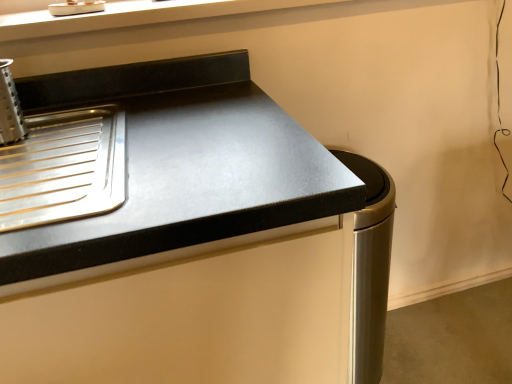
Find the location of a particular element. black matte countertop at upper left is located at coordinates (183, 165).

Image resolution: width=512 pixels, height=384 pixels. What do you see at coordinates (183, 165) in the screenshot?
I see `black matte countertop at upper left` at bounding box center [183, 165].

Where is `satin silver trash can at lower right`? This screenshot has width=512, height=384. satin silver trash can at lower right is located at coordinates (370, 267).

Describe the element at coordinates (370, 267) in the screenshot. The image size is (512, 384). I see `satin silver trash can at lower right` at that location.

The image size is (512, 384). I want to click on black matte countertop at upper left, so click(183, 165).

Between satin silver trash can at lower right and black matte countertop at upper left, which one appears on the right side from the viewer's perspective?

From the viewer's perspective, satin silver trash can at lower right appears more on the right side.

Is satin silver trash can at lower right in front of or behind black matte countertop at upper left in the image?

Clearly, satin silver trash can at lower right is behind black matte countertop at upper left.

Does point (364, 275) come in front of point (95, 240)?

No, (364, 275) is behind (95, 240).

From the image's perspective, is satin silver trash can at lower right above or below black matte countertop at upper left?

satin silver trash can at lower right is situated higher than black matte countertop at upper left in the image.

From a real-world perspective, is satin silver trash can at lower right located higher than black matte countertop at upper left?

No.

Considering the relative sizes of satin silver trash can at lower right and black matte countertop at upper left in the image provided, is satin silver trash can at lower right thinner than black matte countertop at upper left?

Correct, the width of satin silver trash can at lower right is less than that of black matte countertop at upper left.

Is satin silver trash can at lower right taller or shorter than black matte countertop at upper left?

In the image, satin silver trash can at lower right appears to be shorter than black matte countertop at upper left.

Based on their sizes in the image, would you say satin silver trash can at lower right is bigger or smaller than black matte countertop at upper left?

satin silver trash can at lower right is smaller than black matte countertop at upper left.

Is satin silver trash can at lower right not within black matte countertop at upper left?

Yes, satin silver trash can at lower right is outside of black matte countertop at upper left.

Is satin silver trash can at lower right placed right next to black matte countertop at upper left?

No, satin silver trash can at lower right is not beside black matte countertop at upper left.

Is satin silver trash can at lower right positioned with its back to black matte countertop at upper left?

No, satin silver trash can at lower right is not facing the opposite direction of black matte countertop at upper left.

How different are the orientations of satin silver trash can at lower right and black matte countertop at upper left in degrees?

The angle between the facing direction of satin silver trash can at lower right and the facing direction of black matte countertop at upper left is 3.17 degrees.

Measure the distance between satin silver trash can at lower right and black matte countertop at upper left.

satin silver trash can at lower right and black matte countertop at upper left are 17.11 inches apart.

Locate an element on the screen. appliance that appears behind the black matte countertop at upper left is located at coordinates pyautogui.click(x=370, y=267).

Is black matte countertop at upper left at the left side of satin silver trash can at lower right?

Yes, black matte countertop at upper left is to the left of satin silver trash can at lower right.

Which object is closer to the camera, black matte countertop at upper left or satin silver trash can at lower right?

black matte countertop at upper left.

Does point (152, 105) appear closer or farther from the camera than point (367, 200)?

Point (152, 105) appears to be farther away from the viewer than point (367, 200).

From the image's perspective, is black matte countertop at upper left positioned above or below satin silver trash can at lower right?

black matte countertop at upper left is below satin silver trash can at lower right.

Based on the photo, from a real-world perspective, is black matte countertop at upper left on top of satin silver trash can at lower right?

Yes, from a real-world perspective, black matte countertop at upper left is over satin silver trash can at lower right

Which of these two, black matte countertop at upper left or satin silver trash can at lower right, is thinner?

With smaller width is satin silver trash can at lower right.

Considering the sizes of black matte countertop at upper left and satin silver trash can at lower right in the image, is black matte countertop at upper left taller or shorter than satin silver trash can at lower right?

black matte countertop at upper left is taller than satin silver trash can at lower right.

Considering the sizes of objects black matte countertop at upper left and satin silver trash can at lower right in the image provided, who is smaller, black matte countertop at upper left or satin silver trash can at lower right?

satin silver trash can at lower right is smaller.

Can we say black matte countertop at upper left lies outside satin silver trash can at lower right?

Yes, black matte countertop at upper left is not within satin silver trash can at lower right.

Is black matte countertop at upper left far away from satin silver trash can at lower right?

No, there isn't a large distance between black matte countertop at upper left and satin silver trash can at lower right.

Is black matte countertop at upper left facing away from satin silver trash can at lower right?

black matte countertop at upper left is not turned away from satin silver trash can at lower right.

The image size is (512, 384). In order to click on appliance on the right of black matte countertop at upper left in this screenshot , I will do `click(370, 267)`.

Locate an element on the screen. Image resolution: width=512 pixels, height=384 pixels. countertop below the satin silver trash can at lower right (from the image's perspective) is located at coordinates (183, 165).

This screenshot has height=384, width=512. In order to click on appliance that is on the right side of black matte countertop at upper left in this screenshot , I will do `click(370, 267)`.